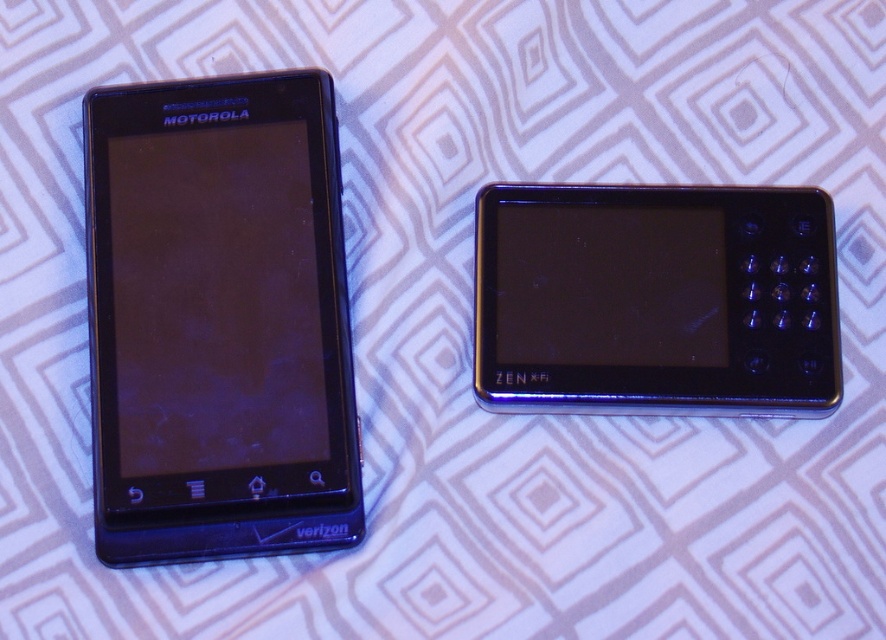
Is point (99, 355) positioned behind point (694, 228)?

No, it is not.

Which is behind, point (131, 456) or point (815, 246)?

The point (815, 246) is more distant.

Is point (239, 378) closer to camera compared to point (729, 289)?

Yes, point (239, 378) is closer to viewer.

Where is `black glossy smartphone at left`? The height and width of the screenshot is (640, 886). black glossy smartphone at left is located at coordinates (218, 321).